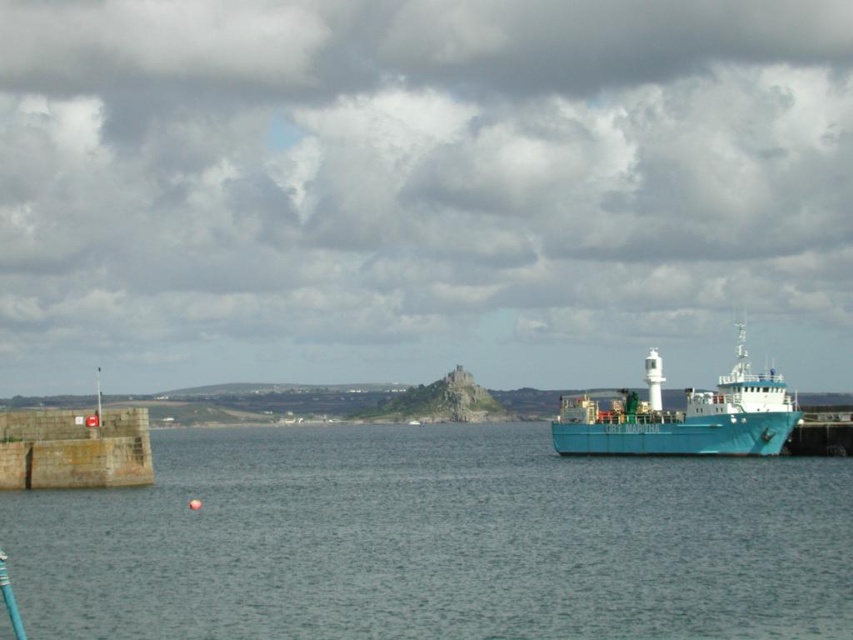
From the picture: You are a photographer planning to take a wide shot of the coastal scene. You want to ensure that both the blue water at center and the teal matte ship at right are clearly visible in the frame. Based on their sizes in the image, which object will occupy more of the frame?

The teal matte ship at right occupies more space in the frame than the blue water at center, as stated in the objects description.

You are standing at the edge of the coastal scene shown. There are two points marked in the image, one at coordinates point (74, 557) and the other at point (784, 387). Which of these points is closer to you?

Point (74, 557) is closer to the viewer than point (784, 387).

Based on the scene description, what is the color of the water at the point marked by coordinates (434, 541)?

The blue water at center is marked by the point (434, 541), so the color is blue.